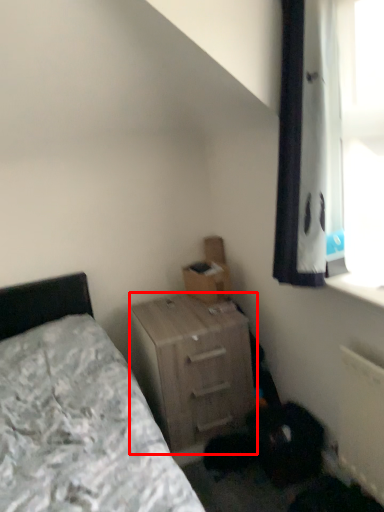
Question: Where is nightstand (annotated by the red box) located in relation to cardboard box in the image?

Choices:
 (A) right
 (B) left

Answer: (B)